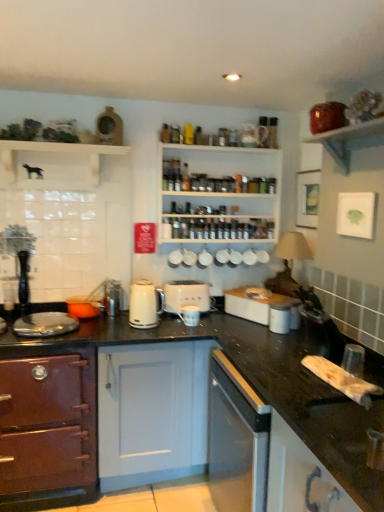
Where is `free point below white glossy kettle at center (from a real-world perspective)`? The width and height of the screenshot is (384, 512). free point below white glossy kettle at center (from a real-world perspective) is located at coordinates (160, 326).